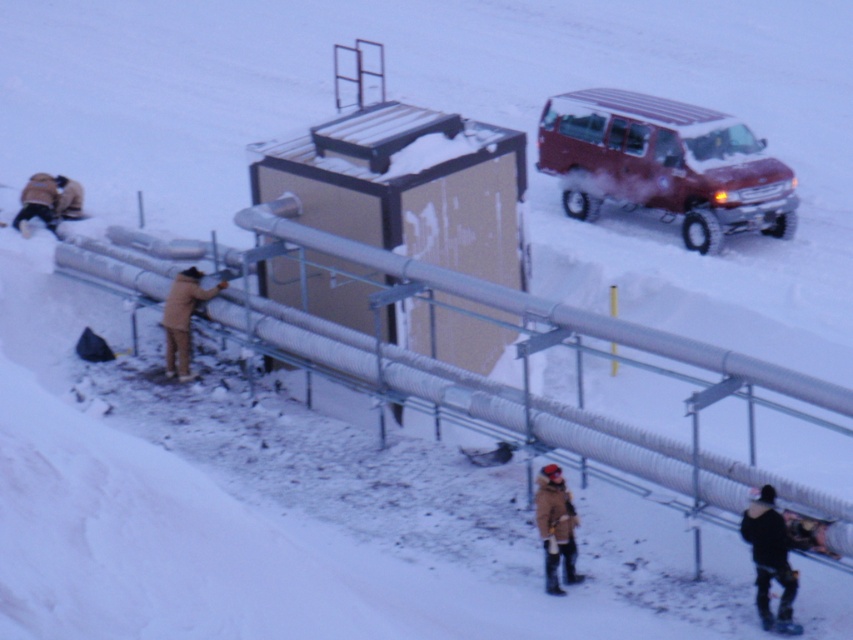
Does dark gray jacket at lower right appear on the left side of beige wool jacket at lower left?

In fact, dark gray jacket at lower right is to the right of beige wool jacket at lower left.

Who is more forward, (762, 508) or (24, 195)?

Positioned in front is point (762, 508).

Image resolution: width=853 pixels, height=640 pixels. In order to click on dark gray jacket at lower right in this screenshot , I will do `click(770, 560)`.

The height and width of the screenshot is (640, 853). I want to click on dark gray jacket at lower right, so click(x=770, y=560).

Does matte red van at upper right come behind brown woolen jacket at upper left?

Yes, matte red van at upper right is further from the viewer.

You are a GUI agent. You are given a task and a screenshot of the screen. Output one action in this format:
    pyautogui.click(x=<x>, y=<y>)
    Task: Click on the matte red van at upper right
    The width and height of the screenshot is (853, 640).
    Given the screenshot: What is the action you would take?
    pyautogui.click(x=664, y=163)

Is brown fuzzy coat at lower center shorter than brown woolen jacket at left?

Yes.

Which of these two, brown fuzzy coat at lower center or brown woolen jacket at left, stands shorter?

brown fuzzy coat at lower center

Is point (566, 540) positioned after point (189, 307)?

No, (566, 540) is in front of (189, 307).

This screenshot has height=640, width=853. What are the coordinates of `brown fuzzy coat at lower center` in the screenshot? It's located at (555, 525).